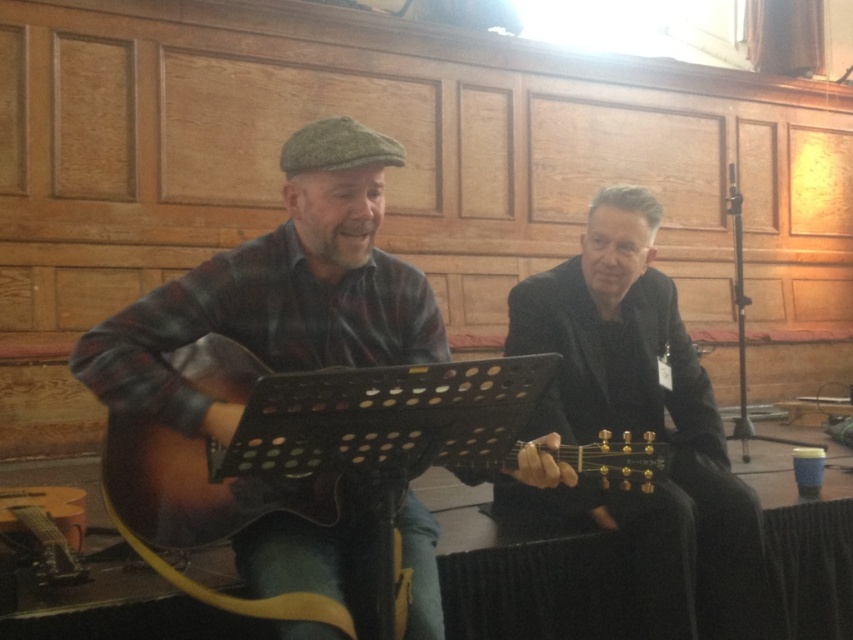
Does matte brown guitar at left appear under matte brown acoustic guitar at left?

Actually, matte brown guitar at left is above matte brown acoustic guitar at left.

This screenshot has height=640, width=853. Identify the location of matte brown guitar at left. (279, 291).

At what (x,y) coordinates should I click in order to perform the action: click on matte brown guitar at left. Please return your answer as a coordinate pair (x, y). This screenshot has height=640, width=853. Looking at the image, I should click on (279, 291).

Who is higher up, shiny black guitar at center or matte brown acoustic guitar at left?

matte brown acoustic guitar at left

Which is behind, point (596, 237) or point (437, 445)?

The point (596, 237) is more distant.

Find the location of a particular element. The height and width of the screenshot is (640, 853). shiny black guitar at center is located at coordinates (642, 424).

Between point (349, 195) and point (653, 292), which one is positioned in front?

Point (349, 195) is in front.

Is matte brown guitar at left wider than shiny black guitar at center?

Yes.

Is point (125, 317) positioned before point (605, 291)?

Yes, point (125, 317) is closer to viewer.

Where is `matte brown guitar at left`? The width and height of the screenshot is (853, 640). matte brown guitar at left is located at coordinates (279, 291).